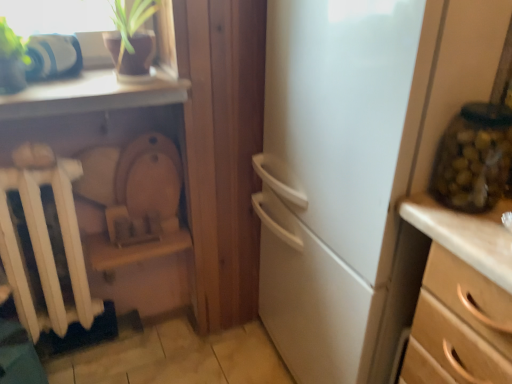
Question: Does white matte radiator at left have a larger size compared to wooden chest of drawers at right?

Choices:
 (A) yes
 (B) no

Answer: (B)

Question: Is white matte radiator at left facing away from wooden chest of drawers at right?

Choices:
 (A) yes
 (B) no

Answer: (B)

Question: Is white matte radiator at left outside of wooden chest of drawers at right?

Choices:
 (A) yes
 (B) no

Answer: (A)

Question: Is white matte radiator at left touching wooden chest of drawers at right?

Choices:
 (A) no
 (B) yes

Answer: (A)

Question: From the image's perspective, would you say white matte radiator at left is shown under wooden chest of drawers at right?

Choices:
 (A) no
 (B) yes

Answer: (A)

Question: From a real-world perspective, is white matte radiator at left physically above wooden chest of drawers at right?

Choices:
 (A) yes
 (B) no

Answer: (A)

Question: From a real-world perspective, is green glass jar at right on top of white matte radiator at left?

Choices:
 (A) yes
 (B) no

Answer: (A)

Question: Considering the relative sizes of green glass jar at right and white matte radiator at left in the image provided, is green glass jar at right wider than white matte radiator at left?

Choices:
 (A) no
 (B) yes

Answer: (A)

Question: Would you say green glass jar at right contains white matte radiator at left?

Choices:
 (A) yes
 (B) no

Answer: (B)

Question: Is green glass jar at right thinner than white matte radiator at left?

Choices:
 (A) no
 (B) yes

Answer: (B)

Question: Is green glass jar at right to the right of white matte radiator at left from the viewer's perspective?

Choices:
 (A) no
 (B) yes

Answer: (B)

Question: Does green glass jar at right come in front of white matte radiator at left?

Choices:
 (A) no
 (B) yes

Answer: (B)

Question: Does wooden chest of drawers at right come behind white matte radiator at left?

Choices:
 (A) yes
 (B) no

Answer: (B)